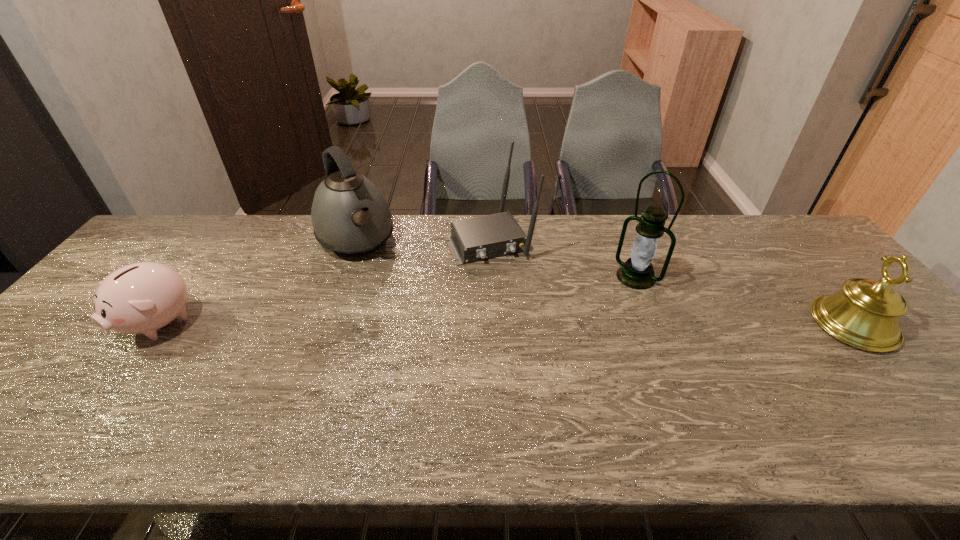
At what (x,y) coordinates should I click in order to perform the action: click on free space that satisfies the following two spatial constraints: 1. on the front side of the lantern; 2. on the left side of the router. Please return your answer as a coordinate pair (x, y). Looking at the image, I should click on (490, 276).

You are a GUI agent. You are given a task and a screenshot of the screen. Output one action in this format:
    pyautogui.click(x=<x>, y=<y>)
    Task: Click on the vacant area in the image that satisfies the following two spatial constraints: 1. on the front side of the lantern; 2. on the left side of the fourth object from right to left
    Image resolution: width=960 pixels, height=540 pixels.
    Given the screenshot: What is the action you would take?
    pyautogui.click(x=342, y=276)

Locate an element on the screen. This screenshot has width=960, height=540. vacant space that satisfies the following two spatial constraints: 1. on the front side of the second object from left to right; 2. on the right side of the third object from left to right is located at coordinates (355, 241).